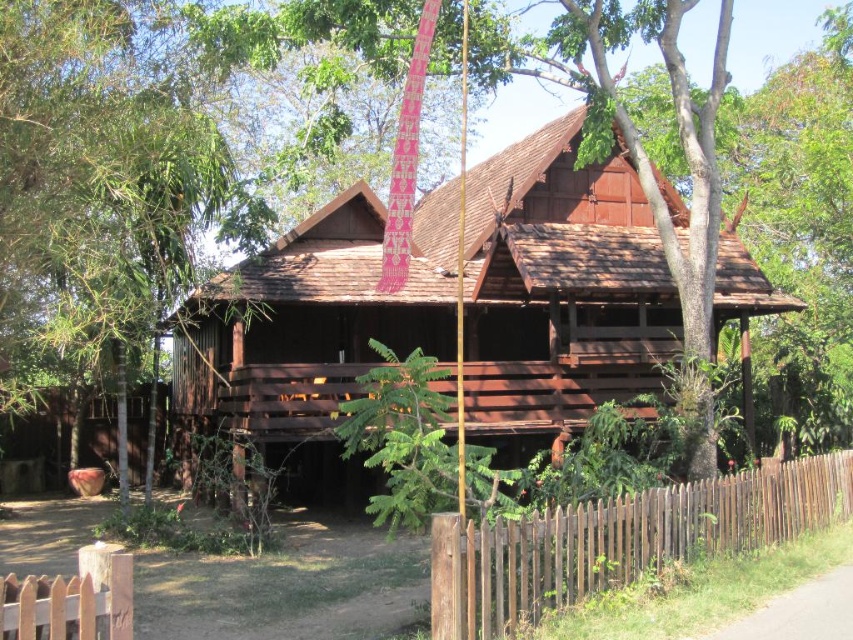
Question: Which object appears closest to the camera in this image?

Choices:
 (A) brown wooden fence at lower left
 (B) brown wooden hut at center

Answer: (A)

Question: Can you confirm if brown wooden hut at center is positioned to the right of brown wooden fence at lower right?

Choices:
 (A) yes
 (B) no

Answer: (B)

Question: Can you confirm if brown wooden hut at center is positioned to the left of brown wooden fence at lower left?

Choices:
 (A) yes
 (B) no

Answer: (B)

Question: Is brown wooden hut at center thinner than brown wooden fence at lower right?

Choices:
 (A) no
 (B) yes

Answer: (A)

Question: Which of the following is the closest to the observer?

Choices:
 (A) (111, 561)
 (B) (672, 205)
 (C) (680, 497)

Answer: (A)

Question: Which point is farther from the camera taking this photo?

Choices:
 (A) (558, 564)
 (B) (670, 314)
 (C) (38, 608)

Answer: (B)